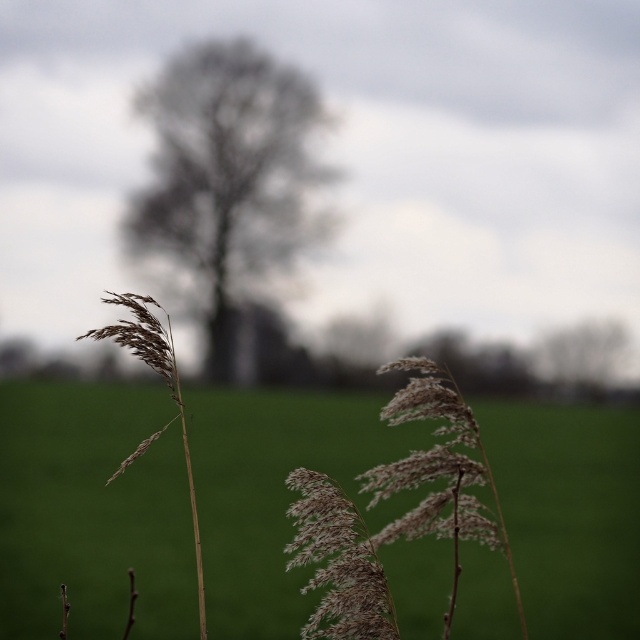
Question: Among these points, which one is nearest to the camera?

Choices:
 (A) (192, 477)
 (B) (188, 83)
 (C) (44, 580)

Answer: (A)

Question: Is dark brown textured tree at center smaller than fuzzy beige reed at center?

Choices:
 (A) yes
 (B) no

Answer: (B)

Question: Can you confirm if white fluffy grass at center is smaller than fuzzy beige reed at center?

Choices:
 (A) no
 (B) yes

Answer: (A)

Question: Is white fluffy grass at center below dark brown textured tree at center?

Choices:
 (A) yes
 (B) no

Answer: (A)

Question: Which of the following is the closest to the observer?

Choices:
 (A) (132, 208)
 (B) (147, 333)

Answer: (B)

Question: Among these objects, which one is nearest to the camera?

Choices:
 (A) dark brown textured tree at center
 (B) white fluffy grass at center

Answer: (B)